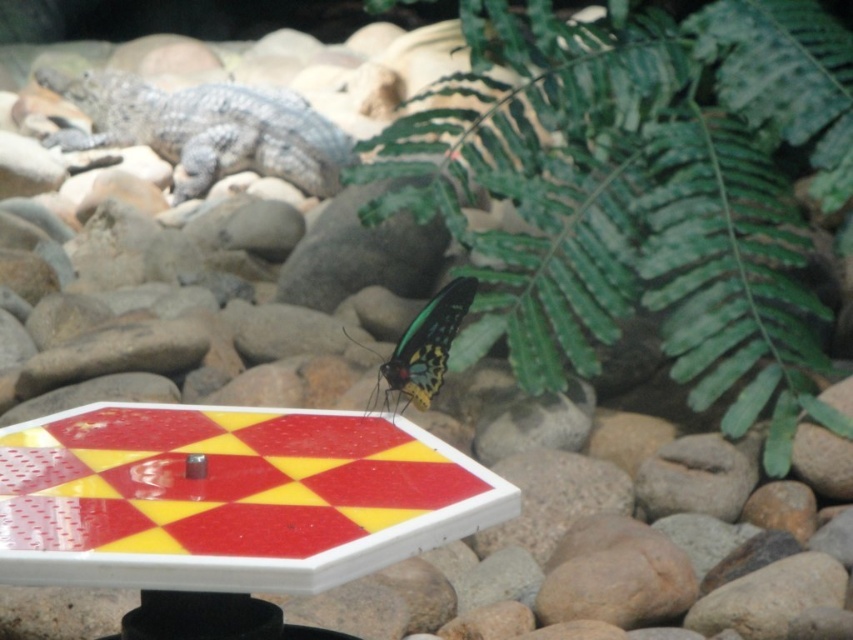
Question: Observing the image, what is the correct spatial positioning of green leafy fern at upper right in reference to shiny metallic butterfly at center?

Choices:
 (A) right
 (B) left

Answer: (A)

Question: Which point appears closest to the camera in this image?

Choices:
 (A) (770, 163)
 (B) (398, 406)

Answer: (B)

Question: In this image, where is green leafy fern at upper right located relative to shiny metallic butterfly at center?

Choices:
 (A) right
 (B) left

Answer: (A)

Question: Which of the following is the closest to the observer?

Choices:
 (A) (428, 384)
 (B) (256, 104)
 (C) (712, 29)

Answer: (A)

Question: Among these points, which one is farthest from the camera?

Choices:
 (A) (344, 132)
 (B) (697, 134)
 (C) (383, 371)

Answer: (A)

Question: Is gray textured crocodile at upper left in front of shiny metallic butterfly at center?

Choices:
 (A) yes
 (B) no

Answer: (B)